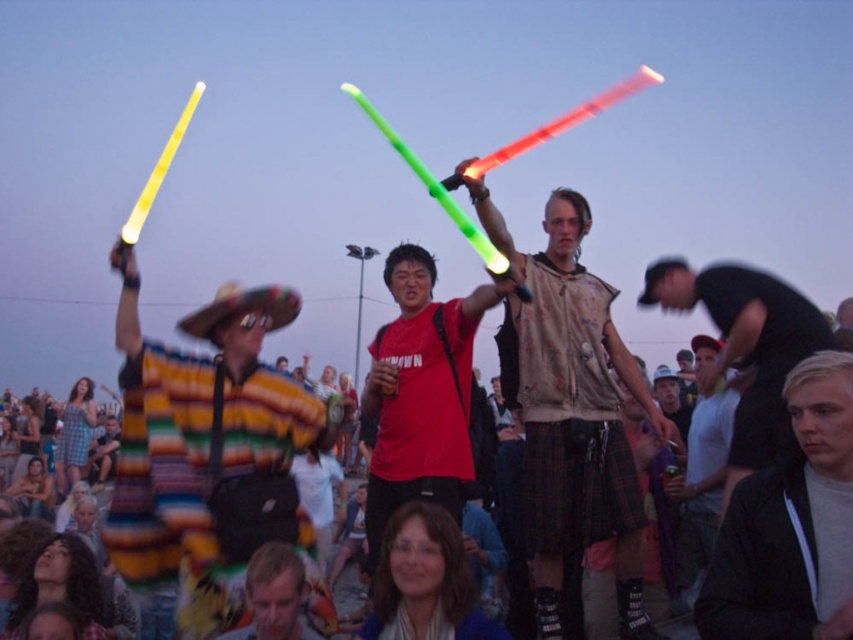
Looking at this image, who is positioned more to the left, gray cotton shirt at lower right or matte red t-shirt at center?

matte red t-shirt at center

Between point (785, 504) and point (451, 461), which one is positioned in front?

Point (785, 504)

You are a GUI agent. You are given a task and a screenshot of the screen. Output one action in this format:
    pyautogui.click(x=<x>, y=<y>)
    Task: Click on the gray cotton shirt at lower right
    The image size is (853, 640).
    Given the screenshot: What is the action you would take?
    pyautogui.click(x=791, y=525)

What do you see at coordinates (421, 392) in the screenshot? I see `matte red t-shirt at center` at bounding box center [421, 392].

Does point (453, 440) lie behind point (254, 561)?

Yes, point (453, 440) is farther from viewer.

Identify the location of matte red t-shirt at center. The image size is (853, 640). (421, 392).

Does gray cotton shirt at lower right appear over white cotton t-shirt at center?

Actually, gray cotton shirt at lower right is below white cotton t-shirt at center.

Can you confirm if gray cotton shirt at lower right is shorter than white cotton t-shirt at center?

Correct, gray cotton shirt at lower right is not as tall as white cotton t-shirt at center.

Is point (781, 560) more distant than point (724, 460)?

That is False.

Image resolution: width=853 pixels, height=640 pixels. What are the coordinates of `gray cotton shirt at lower right` in the screenshot? It's located at (791, 525).